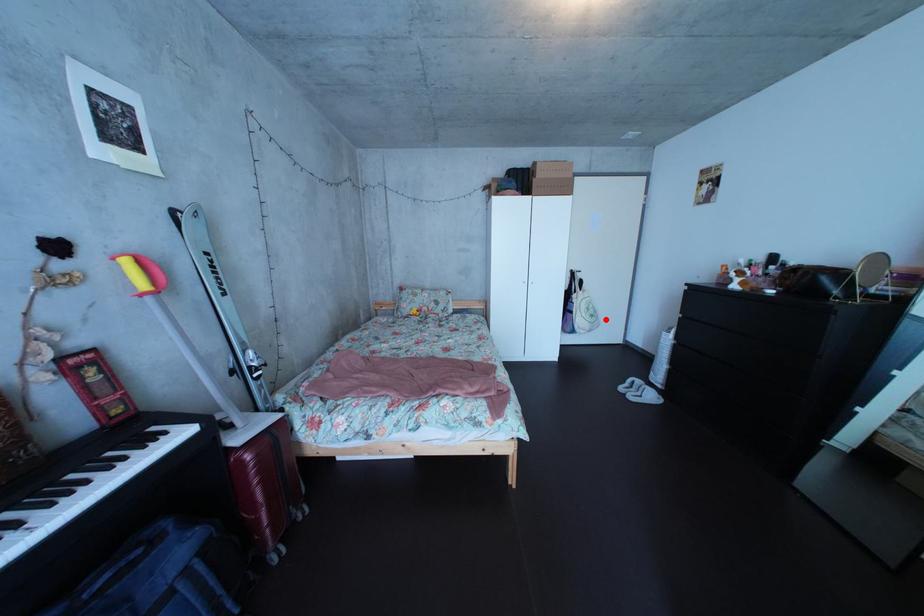
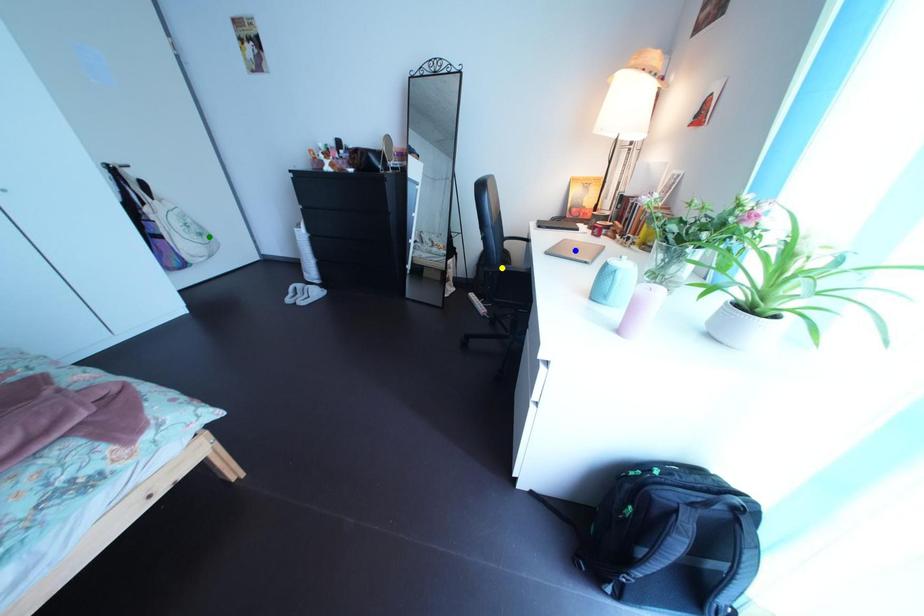
Question: I am providing you with two images of the same scene from different viewpoints. A red point is marked on the first image. You are given multiple points on the second image. Which point in image 2 is actually the same real-world point as the red point in image 1?

Choices:
 (A) yellow point
 (B) green point
 (C) blue point

Answer: (B)